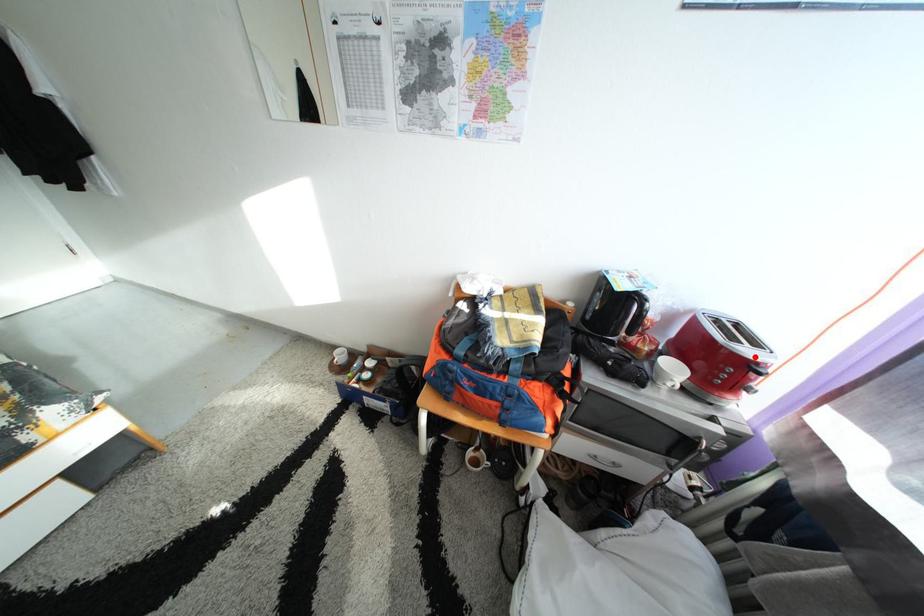
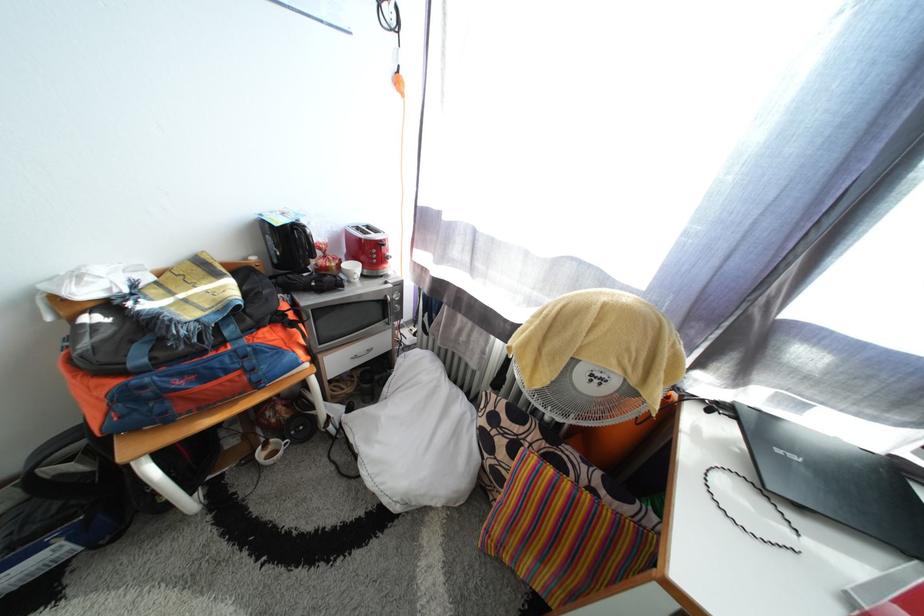
Question: I am providing you with two images of the same scene from different viewpoints. A red point is marked on the first image. At the location where the point appears in image 1, is it still visible in image 2?

Choices:
 (A) Yes
 (B) No

Answer: (A)